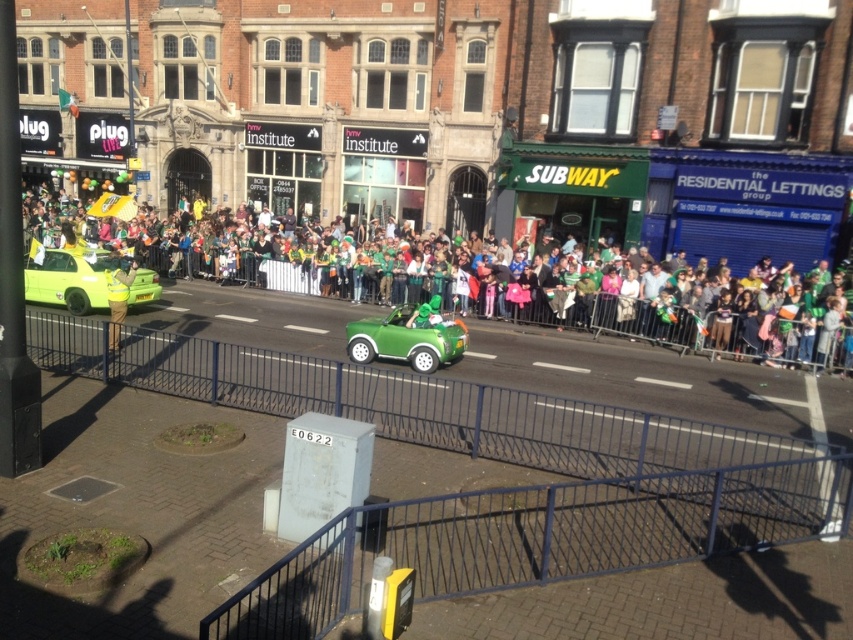
You are a pedestrian standing on the sidewalk watching the parade. You see the green matte car at center and the yellow reflective vest at left. Which object is closer to you?

The green matte car at center is closer to you because it is in front of the yellow reflective vest at left.

You are standing at the point with coordinates point (112, 336) and want to walk to the point with coordinates point (355, 333). Which direction should you face to walk towards your destination?

You should face north because point (355, 333) is behind point (112, 336), indicating it is in the northern direction.